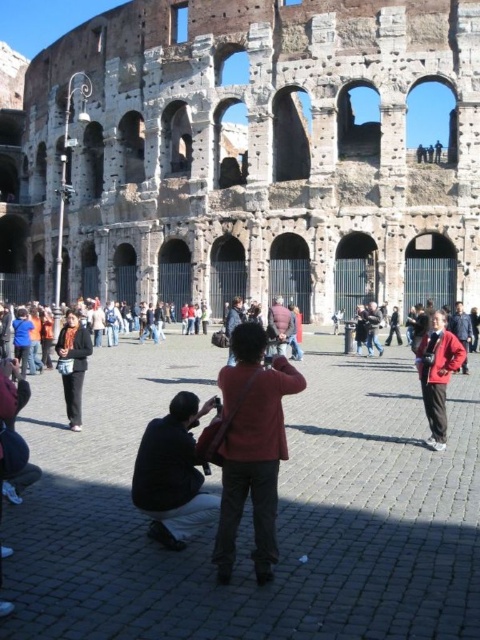
You are a photographer standing in front of the Colosseum and you notice two jackets in the scene. Which jacket, the red fabric jacket at center or the dark gray fabric jacket at lower left, is taller?

The red fabric jacket at center is taller than the dark gray fabric jacket at lower left.

You are standing at the entrance of the Colosseum and want to take a photo of the red fabric jacket at center. According to the scene description, where should you position your camera to capture the jacket in the frame?

The red fabric jacket at center is located at coordinates point (252,448), so you should position your camera to aim at that point to capture the jacket in the frame.